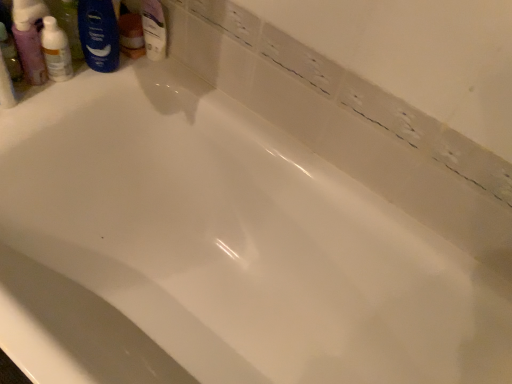
Where is `vacant space to the right of translucent plastic bottle at upper left`? vacant space to the right of translucent plastic bottle at upper left is located at coordinates (114, 73).